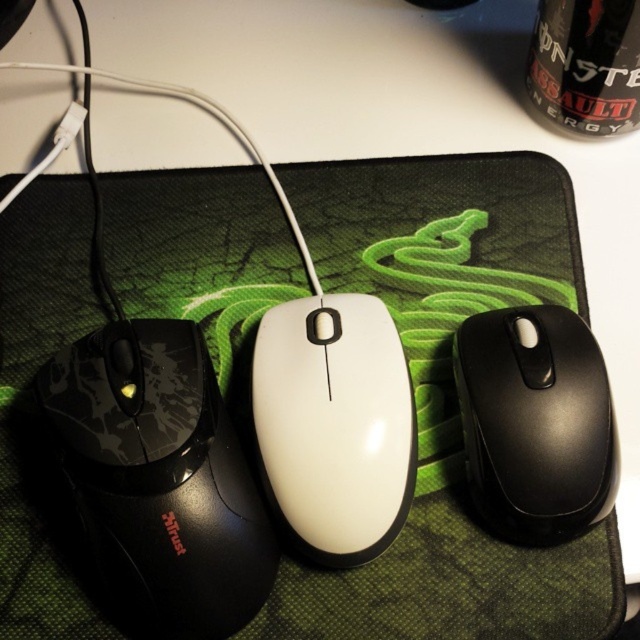
Between green fabric mousepad at center and black matte mouse at lower right, which one has more height?

Standing taller between the two is green fabric mousepad at center.

Is point (51, 230) in front of point (570, 340)?

No, it is not.

Between point (68, 326) and point (499, 528), which one is positioned in front?

Point (499, 528)

The width and height of the screenshot is (640, 640). Find the location of `green fabric mousepad at center`. green fabric mousepad at center is located at coordinates (445, 396).

Who is positioned more to the right, green fabric mousepad at center or white glossy mouse at center?

white glossy mouse at center

Is green fabric mousepad at center in front of white glossy mouse at center?

No.

The height and width of the screenshot is (640, 640). Describe the element at coordinates (445, 396) in the screenshot. I see `green fabric mousepad at center` at that location.

Find the location of `green fabric mousepad at center`. green fabric mousepad at center is located at coordinates (445, 396).

Can you confirm if white glossy mouse at center is bigger than black matte mouse at lower right?

Yes.

Does white glossy mouse at center appear on the right side of black matte mouse at lower right?

Incorrect, white glossy mouse at center is not on the right side of black matte mouse at lower right.

Locate an element on the screen. white glossy mouse at center is located at coordinates (333, 424).

Find the location of a particular element. The image size is (640, 640). white glossy mouse at center is located at coordinates (333, 424).